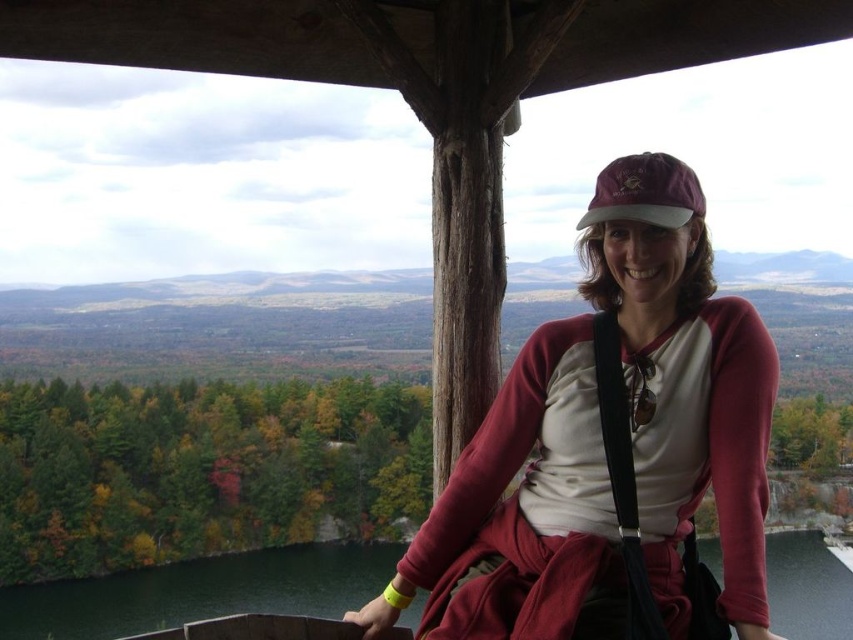
Based on the photo, you are a photographer trying to capture a closeup of the person in the scene. You notice the matte pink sweater at center and the maroon fabric baseball cap at upper center. Which object should you focus on to ensure both are in the frame without moving the camera?

The matte pink sweater at center is wider than the maroon fabric baseball cap at upper center, so focusing on the matte pink sweater at center will ensure both objects are within the frame.

You are a photographer trying to capture the person in the scene. Since you want to ensure both the matte pink sweater at center and the maroon fabric baseball cap at upper center are clearly visible, which object should you focus on first to ensure both are in frame?

The matte pink sweater at center is larger in size than the maroon fabric baseball cap at upper center, so you should focus on the matte pink sweater at center first to ensure both are in frame.

Looking at this image, you are a photographer taking a portrait of the person in the scene. You notice the matte pink sweater at center and the maroon fabric baseball cap at upper center. Which object is positioned to the right of the other?

The matte pink sweater at center is positioned on the right side of maroon fabric baseball cap at upper center.